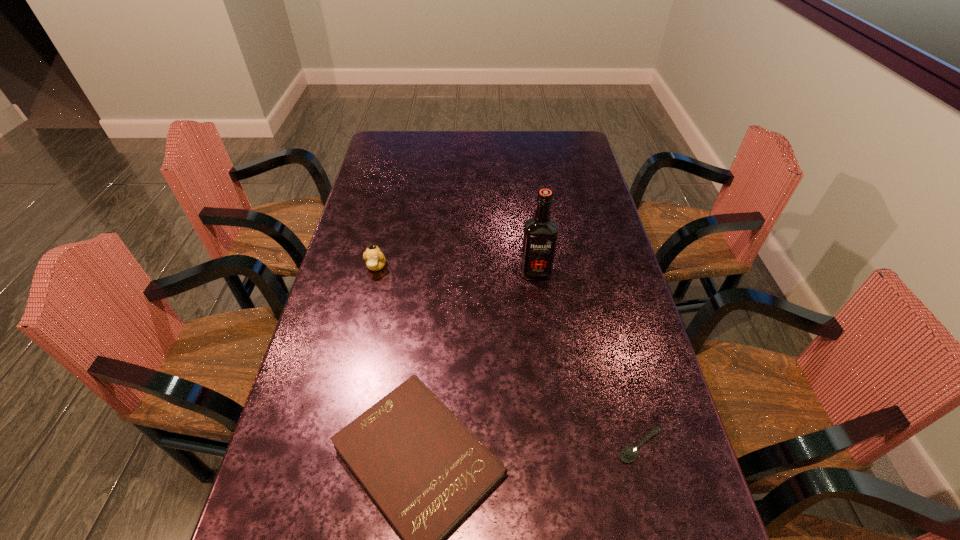
The height and width of the screenshot is (540, 960). What are the coordinates of `vacant space that satisfies the following two spatial constraints: 1. on the front-facing side of the rightmost object; 2. on the left side of the liquor` in the screenshot? It's located at (557, 446).

Find the location of a particular element. The height and width of the screenshot is (540, 960). vacant space that satisfies the following two spatial constraints: 1. on the front-facing side of the soupspoon; 2. on the left side of the third object from left to right is located at coordinates (557, 446).

I want to click on vacant region that satisfies the following two spatial constraints: 1. on the front-facing side of the tallest object; 2. on the right side of the rightmost object, so click(557, 446).